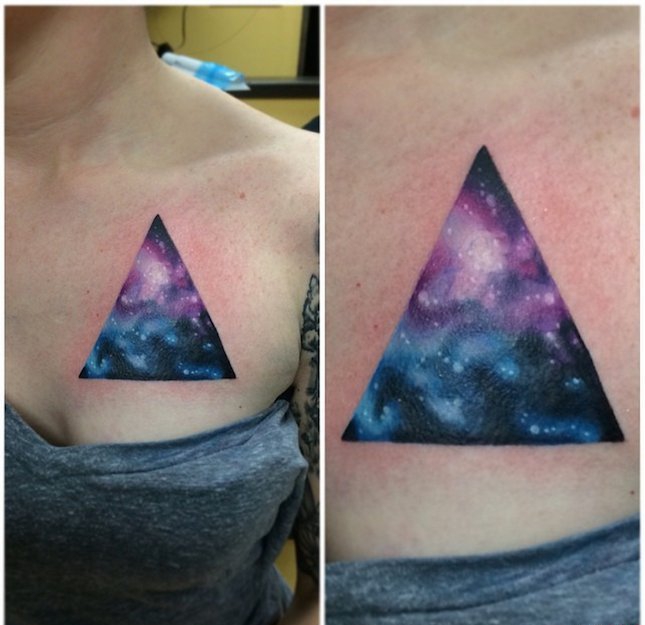
This screenshot has width=645, height=625. Find the location of `flooring`. flooring is located at coordinates (288, 565).